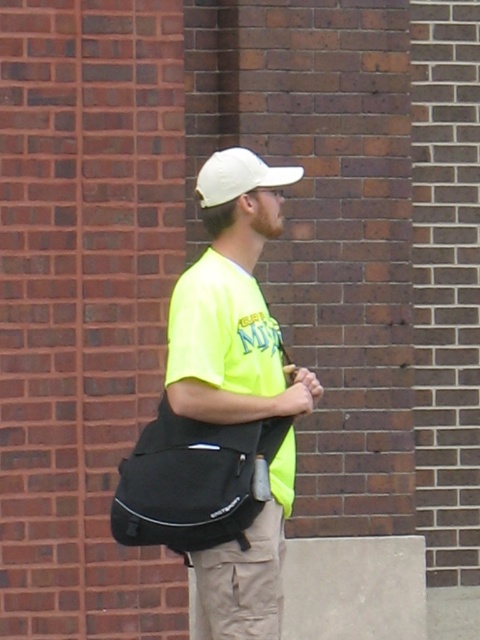
Consider the image. You are a delivery robot with a package that needs to be placed between the black fabric messenger bag at center and the khaki cotton pants at lower center. The package is 5 inches long. Can you fit it between them?

The distance between the black fabric messenger bag at center and the khaki cotton pants at lower center is 4.53 inches. Since the package is 5 inches long, it cannot fit between them as it is longer than the available space.

You are a security camera analyzing the scene. The khaki cotton pants at lower center are located at coordinates. What are their coordinates?

The khaki cotton pants at lower center are located at coordinates point (240,582).